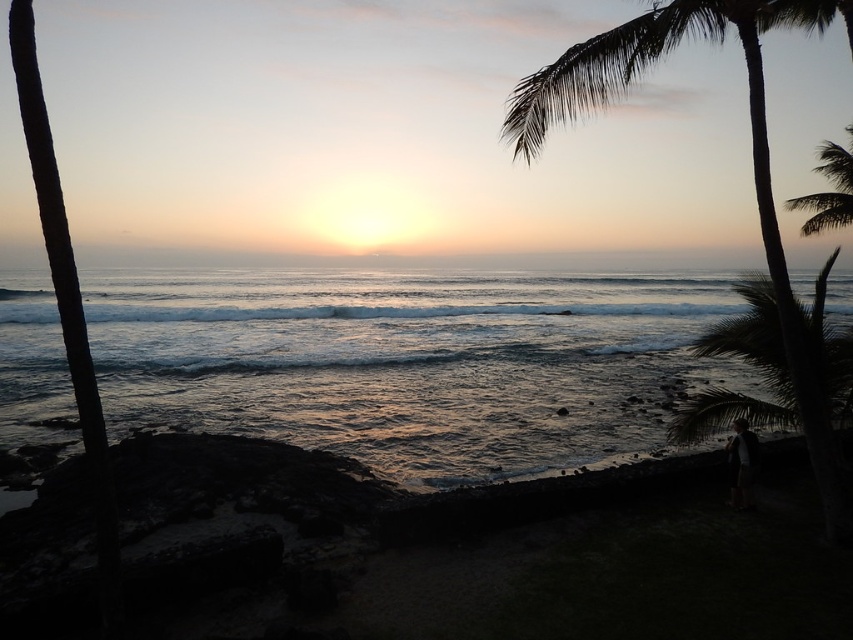
Who is positioned more to the left, green leafy palm tree at right or smooth ocean at center?

Positioned to the left is smooth ocean at center.

Where is `green leafy palm tree at right`? The width and height of the screenshot is (853, 640). green leafy palm tree at right is located at coordinates (751, 152).

Locate an element on the screen. green leafy palm tree at right is located at coordinates (751, 152).

Does shiny blue water at center have a greater width compared to smooth ocean at center?

Incorrect, shiny blue water at center's width does not surpass smooth ocean at center's.

Is point (503, 448) positioned after point (693, 262)?

No.

I want to click on shiny blue water at center, so click(409, 360).

This screenshot has width=853, height=640. Find the location of `shiny blue water at center`. shiny blue water at center is located at coordinates (409, 360).

How much distance is there between smooth ocean at center and silhouette leafy palm at upper right?

131.35 meters

Between smooth ocean at center and silhouette leafy palm at upper right, which one is positioned higher?

smooth ocean at center is higher up.

Describe the element at coordinates (428, 259) in the screenshot. The height and width of the screenshot is (640, 853). I see `smooth ocean at center` at that location.

Locate an element on the screen. smooth ocean at center is located at coordinates 428,259.